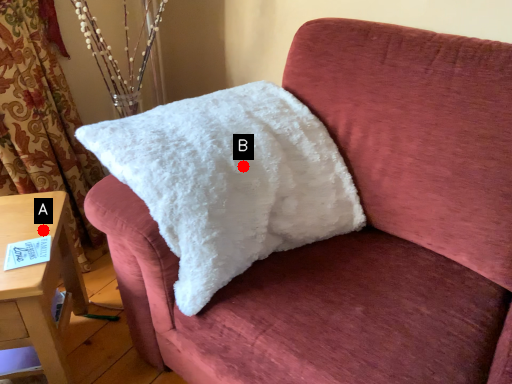
Question: Two points are circled on the image, labeled by A and B beside each circle. Which point is closer to the camera?

Choices:
 (A) A is closer
 (B) B is closer

Answer: (B)